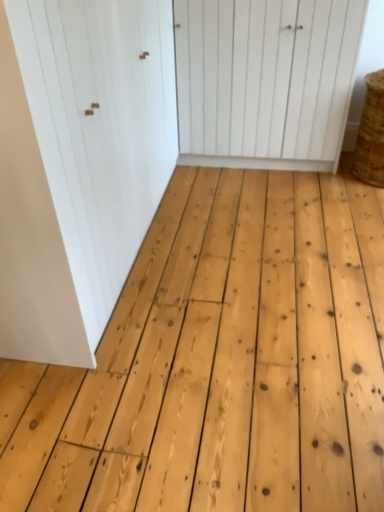
Question: From the image's perspective, is white matte door at upper left, the 1th door in the left-to-right sequence, located above braided straw basket at right?

Choices:
 (A) yes
 (B) no

Answer: (B)

Question: Is white matte door at upper left, the 1th door in the left-to-right sequence, thinner than braided straw basket at right?

Choices:
 (A) no
 (B) yes

Answer: (A)

Question: Considering the relative positions of white matte door at upper left, arranged as the 2th door when viewed from the right, and braided straw basket at right in the image provided, is white matte door at upper left, arranged as the 2th door when viewed from the right, to the left of braided straw basket at right from the viewer's perspective?

Choices:
 (A) yes
 (B) no

Answer: (A)

Question: Is white matte door at upper left, the 1th door in the left-to-right sequence, far from braided straw basket at right?

Choices:
 (A) yes
 (B) no

Answer: (A)

Question: Considering the relative sizes of white matte door at upper left, the 1th door in the left-to-right sequence, and braided straw basket at right in the image provided, is white matte door at upper left, the 1th door in the left-to-right sequence, shorter than braided straw basket at right?

Choices:
 (A) yes
 (B) no

Answer: (B)

Question: Is white matte door at upper left, arranged as the 2th door when viewed from the right, positioned in front of braided straw basket at right?

Choices:
 (A) no
 (B) yes

Answer: (B)

Question: Does braided straw basket at right lie behind white wood door at center, which is counted as the second door, starting from the left?

Choices:
 (A) no
 (B) yes

Answer: (A)

Question: Can you confirm if braided straw basket at right is shorter than white wood door at center, which is counted as the second door, starting from the left?

Choices:
 (A) no
 (B) yes

Answer: (B)

Question: Is braided straw basket at right next to white wood door at center, which is the first door from right to left, and touching it?

Choices:
 (A) yes
 (B) no

Answer: (B)

Question: Can you confirm if braided straw basket at right is smaller than white wood door at center, which is counted as the second door, starting from the left?

Choices:
 (A) yes
 (B) no

Answer: (A)

Question: Can you confirm if braided straw basket at right is positioned to the right of white wood door at center, which is the first door from right to left?

Choices:
 (A) yes
 (B) no

Answer: (A)

Question: Would you say white wood door at center, which is counted as the second door, starting from the left, is part of braided straw basket at right's contents?

Choices:
 (A) yes
 (B) no

Answer: (B)

Question: Could you tell me if white wood door at center, which is the first door from right to left, is facing white matte door at upper left, the 1th door in the left-to-right sequence?

Choices:
 (A) yes
 (B) no

Answer: (B)